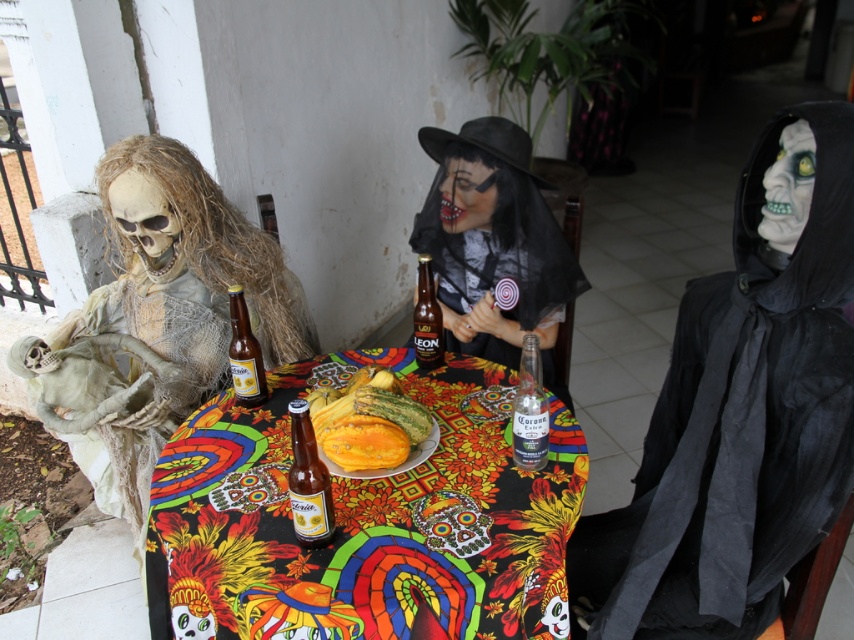
Does multicolored fabric table at center appear on the right side of translucent glass bottle at center?

Incorrect, multicolored fabric table at center is not on the right side of translucent glass bottle at center.

Does point (284, 380) lie in front of point (539, 380)?

No, it is not.

You are a GUI agent. You are given a task and a screenshot of the screen. Output one action in this format:
    pyautogui.click(x=<x>, y=<y>)
    Task: Click on the multicolored fabric table at center
    
    Given the screenshot: What is the action you would take?
    pyautogui.click(x=366, y=520)

Can you confirm if matte white skeleton at left is positioned below matte black dress at center?

Correct, matte white skeleton at left is located below matte black dress at center.

Is point (89, 344) positioned behind point (453, 285)?

That is False.

What do you see at coordinates (156, 321) in the screenshot? Image resolution: width=854 pixels, height=640 pixels. I see `matte white skeleton at left` at bounding box center [156, 321].

Identify the location of matte white skeleton at left. This screenshot has height=640, width=854. (156, 321).

Identify the location of matte black dress at center. This screenshot has height=640, width=854. pyautogui.click(x=494, y=244).

Can you confirm if matte black dress at center is positioned to the left of translucent glass bottle at center?

Yes, matte black dress at center is to the left of translucent glass bottle at center.

Between point (529, 300) and point (525, 396), which one is positioned in front?

Point (525, 396) is in front.

Locate an element on the screen. This screenshot has width=854, height=640. matte black dress at center is located at coordinates 494,244.